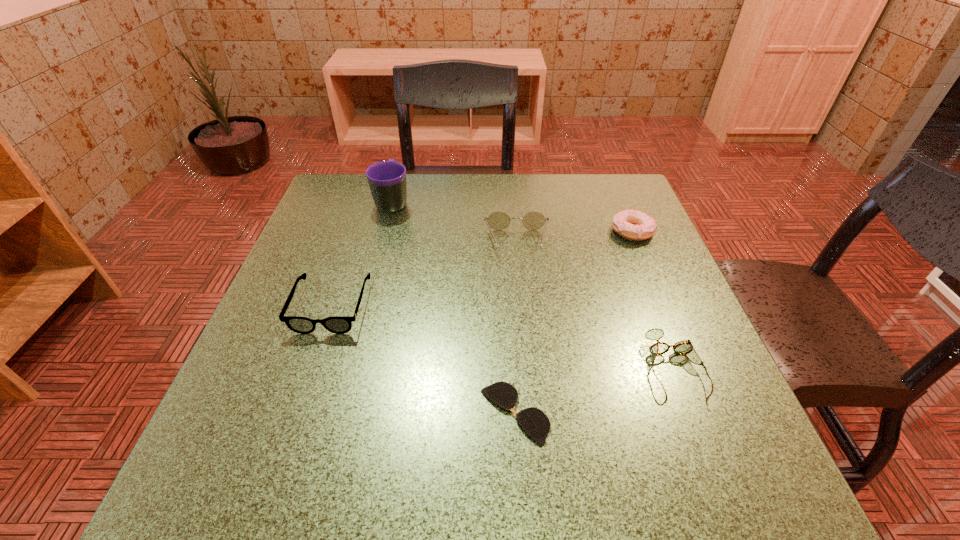
At what (x,y) coordinates should I click in order to perform the action: click on free space located on the front of the doughnut. Please return your answer as a coordinate pair (x, y). Looking at the image, I should click on (660, 298).

Find the location of a particular element. The image size is (960, 540). vacant space located 0.150m on the front-facing side of the rightmost spectacles is located at coordinates (724, 498).

Where is `vacant space located on the left of the shortest object`? vacant space located on the left of the shortest object is located at coordinates (230, 414).

Identify the location of mug that is positioned at the far edge. The image size is (960, 540). (387, 179).

Identify the location of doughnut present at the far edge. (632, 224).

Locate an element on the screen. The height and width of the screenshot is (540, 960). object that is at the near edge is located at coordinates (536, 424).

This screenshot has height=540, width=960. Find the location of `mug located at the left edge`. mug located at the left edge is located at coordinates (387, 179).

Identify the location of spectacles at the left edge. The width and height of the screenshot is (960, 540). (337, 324).

You are a GUI agent. You are given a task and a screenshot of the screen. Output one action in this format:
    pyautogui.click(x=<x>, y=<y>)
    Task: Click on the doughnut situated at the right edge
    The height and width of the screenshot is (540, 960).
    Given the screenshot: What is the action you would take?
    pyautogui.click(x=632, y=224)

At what (x,y) coordinates should I click in order to perform the action: click on spectacles that is at the right edge. Please return your answer as a coordinate pair (x, y). Image resolution: width=960 pixels, height=540 pixels. Looking at the image, I should click on (685, 348).